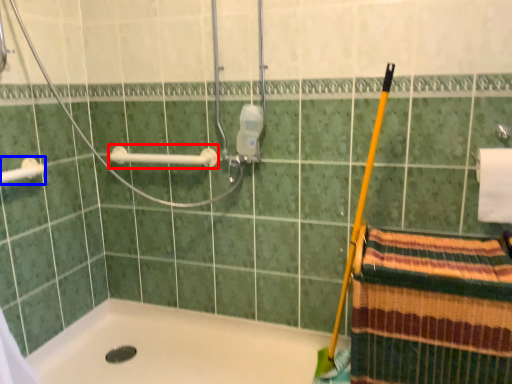
Question: Which of the following is the farthest to the observer, towel bar (highlighted by a red box) or towel bar (highlighted by a blue box)?

Choices:
 (A) towel bar
 (B) towel bar

Answer: (A)